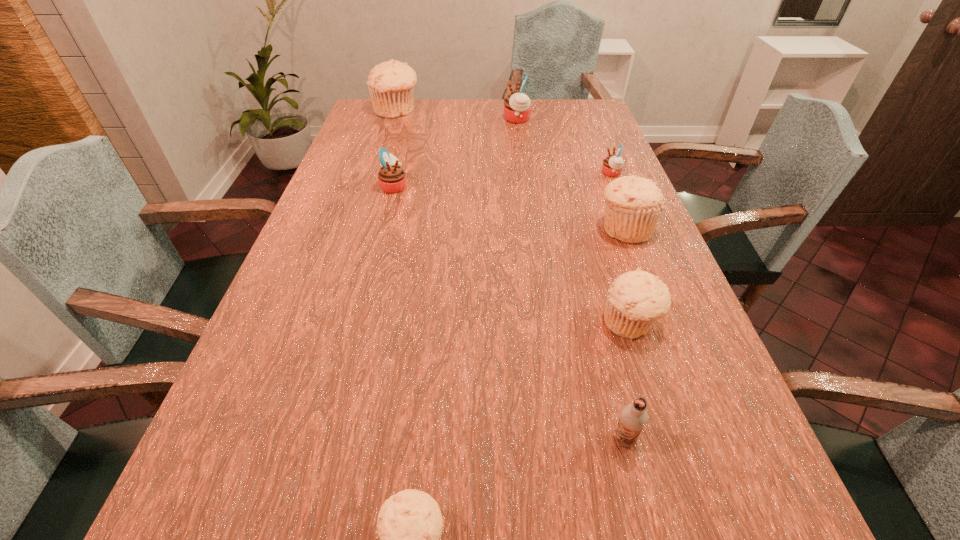
At what (x,y) coordinates should I click in order to perform the action: click on pink muffin that stands as the closest to the rightmost pink muffin. Please return your answer as a coordinate pair (x, y). Looking at the image, I should click on (517, 109).

The width and height of the screenshot is (960, 540). I want to click on free spot that satisfies the following two spatial constraints: 1. on the front-facing side of the smallest pink muffin; 2. on the front side of the second nearest muffin, so click(x=672, y=323).

Find the location of a particular element. Image resolution: width=960 pixels, height=540 pixels. vacant region that satisfies the following two spatial constraints: 1. on the front-facing side of the second smallest pink muffin; 2. on the left side of the third farthest beige muffin is located at coordinates (x=359, y=323).

Locate an element on the screen. vacant point that satisfies the following two spatial constraints: 1. on the front-facing side of the second biggest pink muffin; 2. on the left side of the second smallest beige muffin is located at coordinates (359, 323).

Identify the location of vacant space that satisfies the following two spatial constraints: 1. on the back side of the third farthest beige muffin; 2. on the front-facing side of the leftmost pink muffin. (587, 186).

In order to click on vacant space that satisfies the following two spatial constraints: 1. on the front-facing side of the third nearest beige muffin; 2. on the left side of the fourth object from left to right in this screenshot , I will do `click(532, 229)`.

Locate an element on the screen. free space in the image that satisfies the following two spatial constraints: 1. on the back side of the sixth farthest object; 2. on the front-facing side of the second smallest pink muffin is located at coordinates (587, 186).